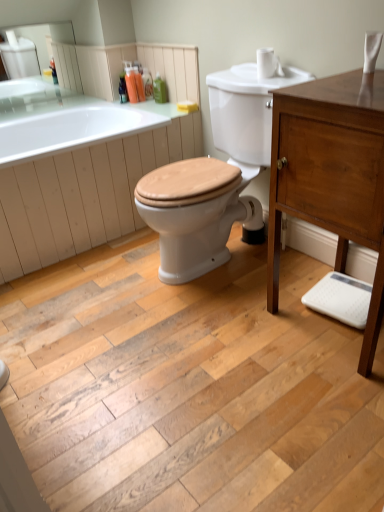
Find the location of a particular element. The image size is (384, 512). free location to the left of matte brown cabinet at right is located at coordinates (251, 338).